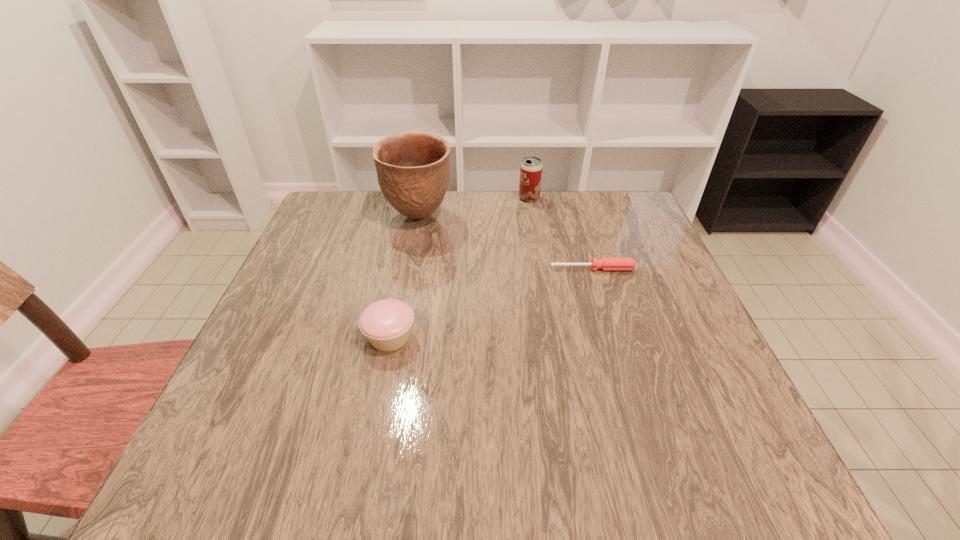
Locate an element on the screen. Image resolution: width=960 pixels, height=540 pixels. the tallest object is located at coordinates 413,168.

The width and height of the screenshot is (960, 540). Identify the location of the second tallest object. (531, 168).

Find the location of a particular element. cupcake is located at coordinates (387, 323).

What are the coordinates of `the nearest object` in the screenshot? It's located at (387, 323).

The image size is (960, 540). What are the coordinates of `screwdriver` in the screenshot? It's located at (606, 264).

Where is `the third farthest object`? This screenshot has width=960, height=540. the third farthest object is located at coordinates (606, 264).

Where is `vacant space situated on the right of the pottery`? Image resolution: width=960 pixels, height=540 pixels. vacant space situated on the right of the pottery is located at coordinates (547, 217).

At what (x,y) coordinates should I click in order to perform the action: click on vacant region located on the left of the second tallest object. Please return your answer as a coordinate pair (x, y). The width and height of the screenshot is (960, 540). Looking at the image, I should click on (458, 198).

You are a GUI agent. You are given a task and a screenshot of the screen. Output one action in this format:
    pyautogui.click(x=<x>, y=<y>)
    Task: Click on the free space located 0.120m on the back of the second shortest object
    This screenshot has height=540, width=960.
    Given the screenshot: What is the action you would take?
    pyautogui.click(x=401, y=280)

You are a GUI agent. You are given a task and a screenshot of the screen. Output one action in this format:
    pyautogui.click(x=<x>, y=<y>)
    Task: Click on the free space located 0.190m on the left of the third farthest object
    
    Given the screenshot: What is the action you would take?
    pyautogui.click(x=471, y=269)